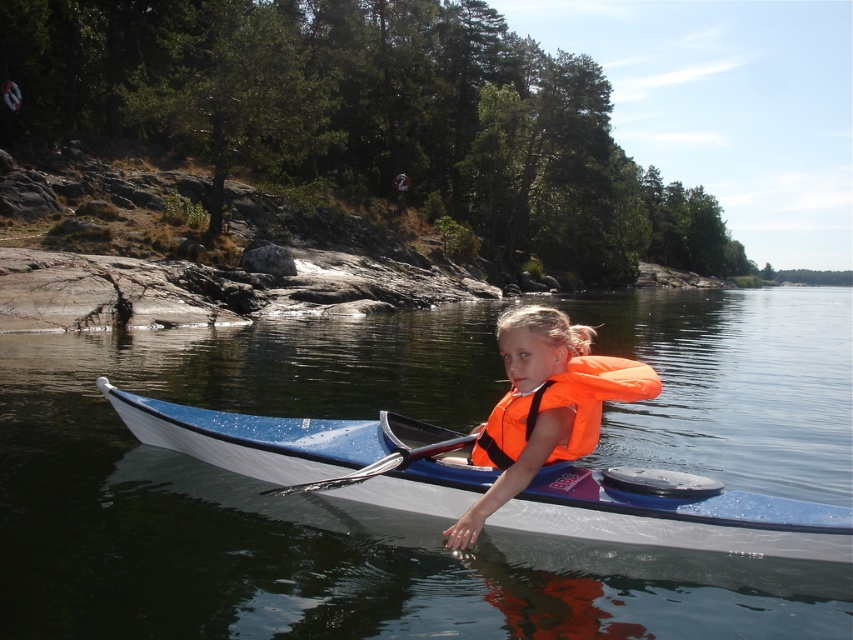
You are planning to place a 4.5 meter long boat in the water. The boat requires at least 5 meters of space to maneuver safely. Can you determine if there is enough space between the orange life vest at center and the nearest obstacle?

The orange life vest at center is 4.22 meters away from the nearest obstacle. Since the boat requires 5 meters of space to maneuver safely and the available space is less than that, there is not enough space.

You are a photographer trying to capture the orange fabric life jacket at center and the metallic silver paddle at center in the same frame. Which object should you zoom in on to ensure both are clearly visible?

The orange fabric life jacket at center is smaller than the metallic silver paddle at center, so you should zoom in on the orange fabric life jacket at center to ensure both are clearly visible.